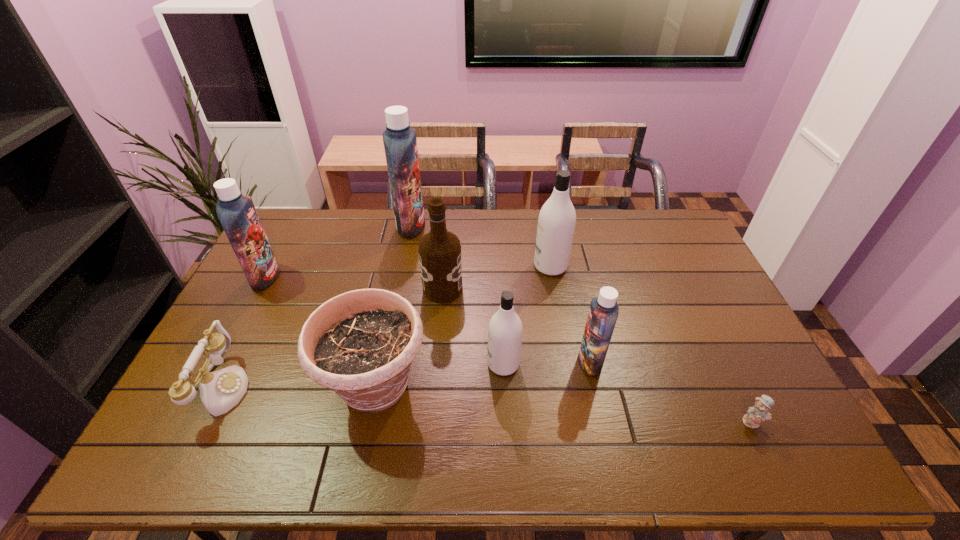
What are the coordinates of `the fifth closest object relative to the bigger white shampoo` in the screenshot? It's located at pyautogui.click(x=361, y=344).

Identify which shampoo is the closest to the biggest blue shampoo. Please provide its 2D coordinates. Your answer should be formatted as a tuple, i.e. [(x, y)], where the tuple contains the x and y coordinates of a point satisfying the conditions above.

[(237, 214)]

Locate an element on the screen. Image resolution: width=960 pixels, height=540 pixels. shampoo object that ranks as the fourth closest to the tallest object is located at coordinates (603, 313).

At what (x,y) coordinates should I click in order to perform the action: click on blue shampoo object that ranks as the third closest to the flowerpot. Please return your answer as a coordinate pair (x, y). This screenshot has width=960, height=540. Looking at the image, I should click on (400, 142).

The image size is (960, 540). Identify the location of blue shampoo identified as the closest to the second biggest blue shampoo. (400, 142).